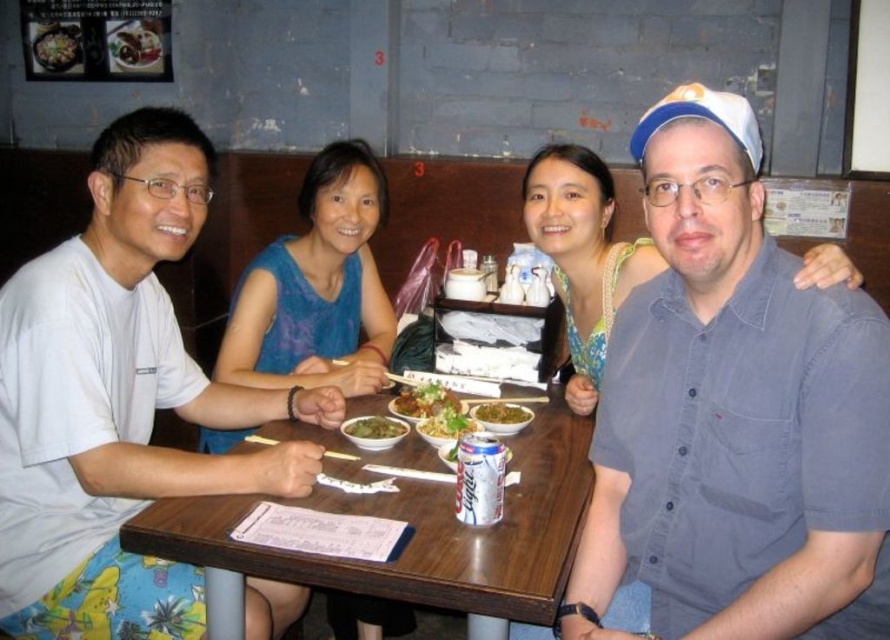
Question: Which is nearer to the brown wooden table at center?

Choices:
 (A) green leafy vegetable at center
 (B) green leafy vegetables at table center

Answer: (B)

Question: Which point appears closest to the camera in this image?

Choices:
 (A) (442, 561)
 (B) (401, 394)
 (C) (455, 428)
 (D) (370, 426)

Answer: (A)

Question: Considering the relative positions of green leafy vegetable at table center and green leafy vegetable at center in the image provided, where is green leafy vegetable at table center located with respect to green leafy vegetable at center?

Choices:
 (A) left
 (B) right

Answer: (A)

Question: Estimate the real-world distances between objects in this image. Which object is farther from the white cotton shirt at left?

Choices:
 (A) green leafy vegetable at center
 (B) brown wooden table at center

Answer: (A)

Question: Is green leafy vegetables at table center bigger than green leafy vegetable at center?

Choices:
 (A) yes
 (B) no

Answer: (A)

Question: Can you confirm if blue denim shirt at right is wider than green leafy vegetable at table center?

Choices:
 (A) no
 (B) yes

Answer: (B)